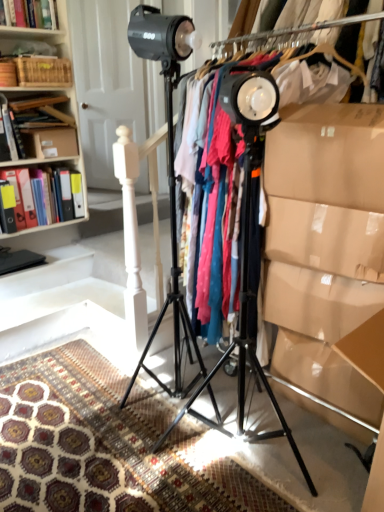
Question: From their relative heights in the image, would you say black matte tripod at center, which is the first tripod from left to right, is taller or shorter than black matte tripod at center, placed as the first tripod when sorted from right to left?

Choices:
 (A) short
 (B) tall

Answer: (B)

Question: Is black matte tripod at center, which appears as the second tripod when viewed from the right, wider or thinner than black matte tripod at center, the 2th tripod when ordered from left to right?

Choices:
 (A) thin
 (B) wide

Answer: (A)

Question: Which object is positioned farthest from the brown cardboard box at upper left?

Choices:
 (A) wooden crate at upper left
 (B) matte plastic folders at left, which is the 2th book from bottom to top
 (C) black matte book at lower left, the third book from the top
 (D) black matte tripod at center, which is the first tripod from left to right
 (E) hardcover book at upper left, the 1th book when ordered from top to bottom

Answer: (D)

Question: Which object is the closest to the black matte tripod at center, which is the first tripod from left to right?

Choices:
 (A) hardcover book at upper left, the 1th book when ordered from top to bottom
 (B) wooden crate at upper left
 (C) black matte tripod at center, the 2th tripod when ordered from left to right
 (D) patterned carpet at center
 (E) matte plastic folders at left, which is the 2th book from bottom to top

Answer: (C)